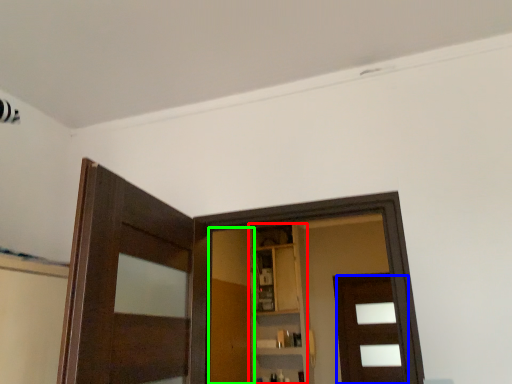
Question: Based on their relative distances, which object is farther from cabinetry (highlighted by a red box)? Choose from door (highlighted by a blue box) and barn door (highlighted by a green box).

Choices:
 (A) door
 (B) barn door

Answer: (A)